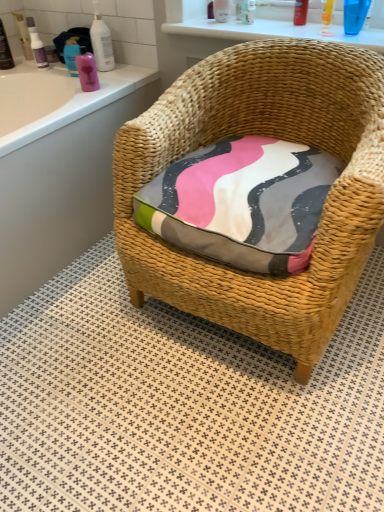
Locate an element on the screen. vacant area that lies in front of matte plastic bottle at upper left, the 2th toiletry in the left-to-right sequence is located at coordinates (30, 62).